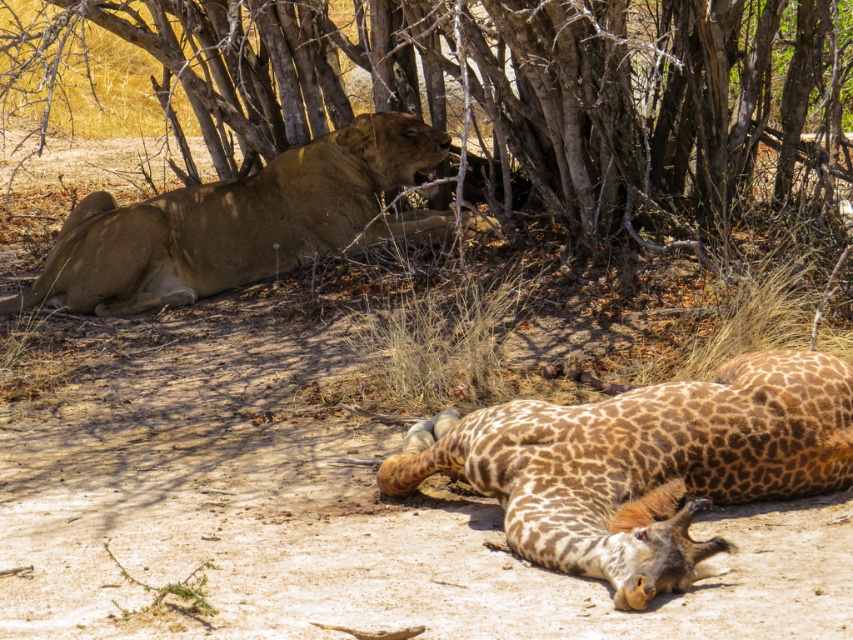
You are a wildlife photographer observing the scene. You need to position your camera so that both the brown bark tree at upper center and the golden fur lion at center are in frame. Based on their positions, which object should be placed to the right side of your camera frame?

The brown bark tree at upper center should be placed to the right side of your camera frame because it is positioned to the right of the golden fur lion at center.